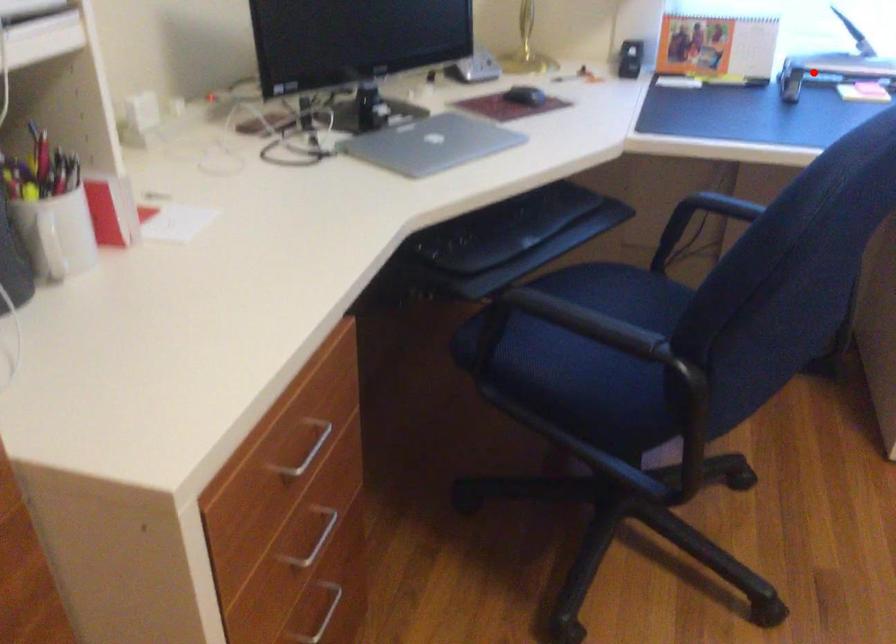
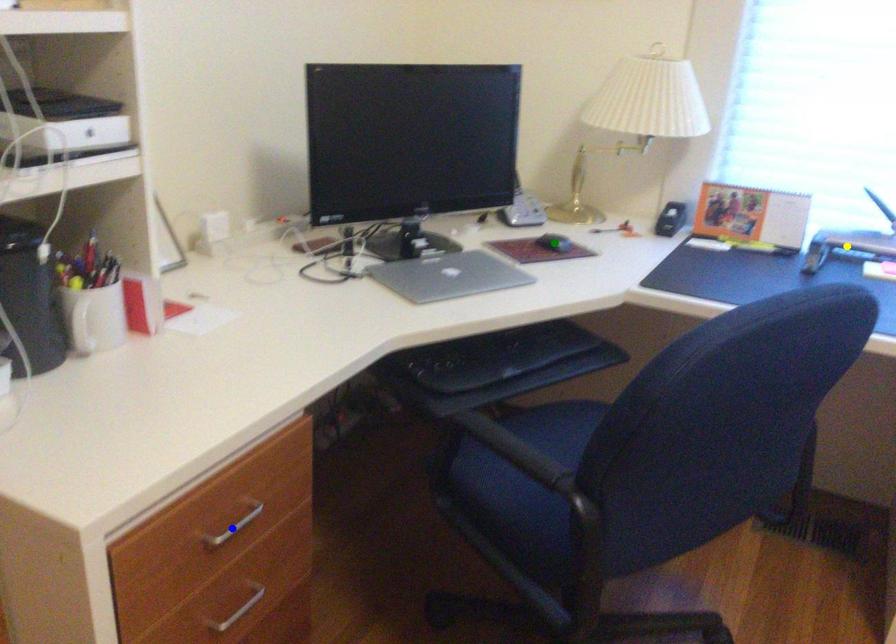
Question: I am providing you with two images of the same scene from different viewpoints. A red point is marked on the first image. You are given multiple points on the second image. Can you choose the point in image 2 that corresponds to the point in image 1?

Choices:
 (A) green point
 (B) yellow point
 (C) blue point

Answer: (B)